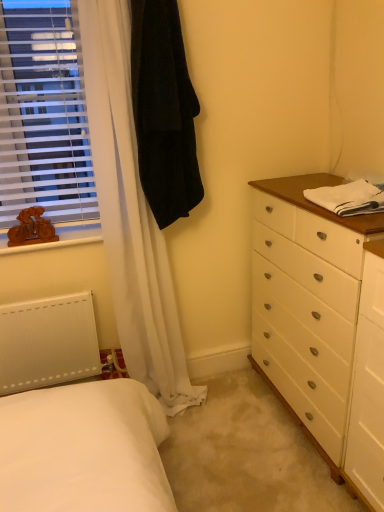
Find the location of a particular element. The height and width of the screenshot is (512, 384). vacant space situated above wooden figure at left (from a real-world perspective) is located at coordinates (59, 233).